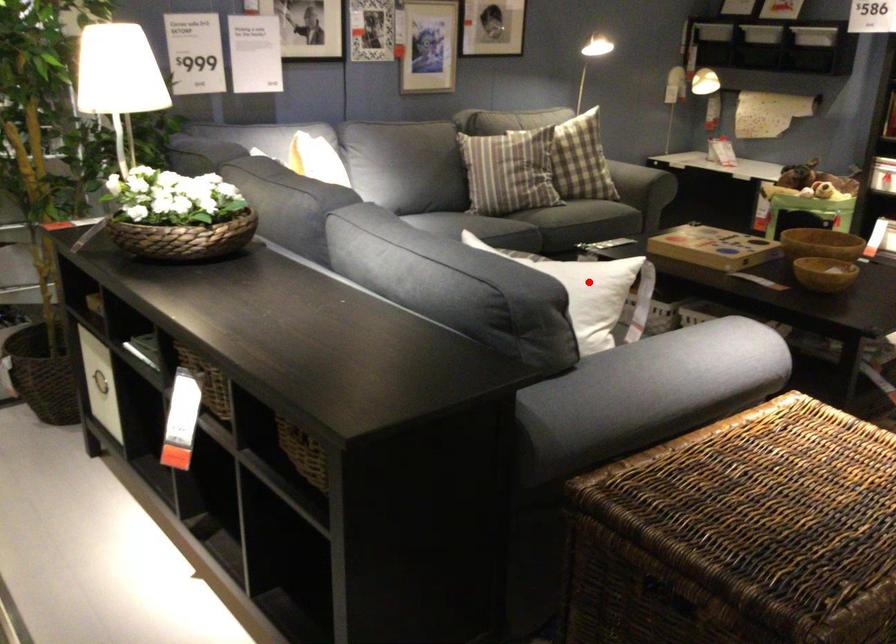
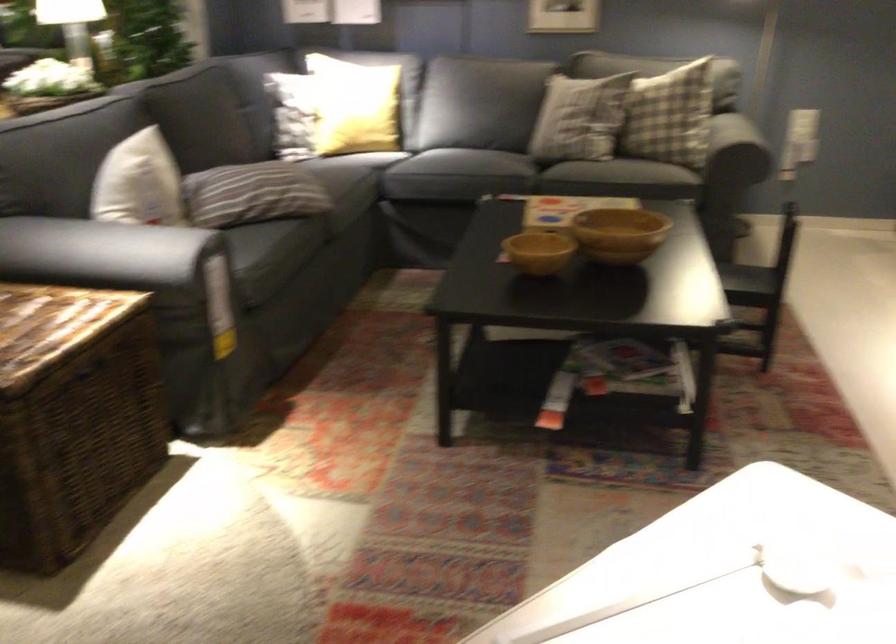
The point at the highlighted location is marked in the first image. Where is the corresponding point in the second image?

(139, 183)